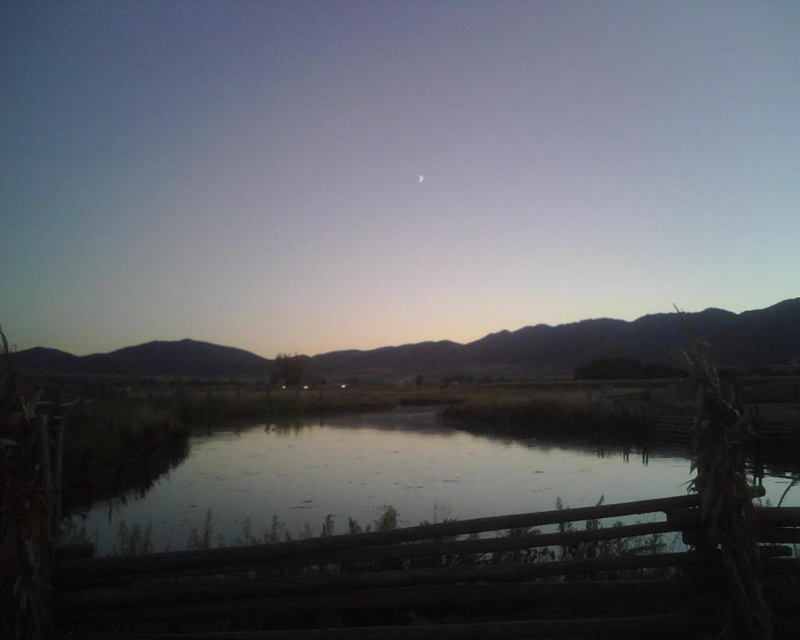
Is the position of smooth reflective water at center more distant than that of brown matte mountain at center?

No, smooth reflective water at center is closer to the viewer.

Does smooth reflective water at center appear on the left side of brown matte mountain at center?

In fact, smooth reflective water at center is to the right of brown matte mountain at center.

Locate an element on the screen. The image size is (800, 640). smooth reflective water at center is located at coordinates (362, 483).

The height and width of the screenshot is (640, 800). I want to click on smooth reflective water at center, so click(362, 483).